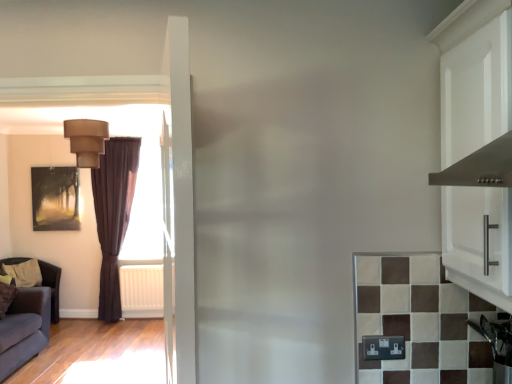
You are a GUI agent. You are given a task and a screenshot of the screen. Output one action in this format:
    pyautogui.click(x=<x>, y=<y>)
    Task: Click on the dark brown leather armchair at left
    The height and width of the screenshot is (384, 512).
    Given the screenshot: What is the action you would take?
    pyautogui.click(x=52, y=286)

What do you see at coordinates (498, 346) in the screenshot?
I see `stainless steel oven at lower right` at bounding box center [498, 346].

Image resolution: width=512 pixels, height=384 pixels. What do you see at coordinates (25, 328) in the screenshot?
I see `dark gray fabric couch at lower left` at bounding box center [25, 328].

This screenshot has width=512, height=384. I want to click on white plastic radiator at left, so click(141, 287).

Locate an element on the screen. matte beige lampshade at upper left is located at coordinates (86, 140).

Identify the location of dark brown leather armchair at left. The image size is (512, 384). (52, 286).

How much distance is there between brown velvet curtain at left and dark brown leather armchair at left?

brown velvet curtain at left and dark brown leather armchair at left are 84.39 centimeters apart.

Based on the photo, considering the relative sizes of brown velvet curtain at left and dark brown leather armchair at left in the image provided, is brown velvet curtain at left shorter than dark brown leather armchair at left?

Incorrect, the height of brown velvet curtain at left does not fall short of that of dark brown leather armchair at left.

Can you tell me how much brown velvet curtain at left and dark brown leather armchair at left differ in facing direction?

The angular difference between brown velvet curtain at left and dark brown leather armchair at left is 89.4 degrees.

Is brown velvet curtain at left next to dark brown leather armchair at left and touching it?

No, brown velvet curtain at left is not making contact with dark brown leather armchair at left.

From a real-world perspective, is dark brown leather armchair at left above or below brown velvet curtain at left?

In terms of real-world spatial position, dark brown leather armchair at left is below brown velvet curtain at left.

Considering the positions of objects dark brown leather armchair at left and brown velvet curtain at left in the image provided, who is behind, dark brown leather armchair at left or brown velvet curtain at left?

brown velvet curtain at left.

At what (x,y) coordinates should I click in order to perform the action: click on furniture that is under the brown velvet curtain at left (from a real-world perspective). Please return your answer as a coordinate pair (x, y). The width and height of the screenshot is (512, 384). Looking at the image, I should click on (52, 286).

Which object is further away from the camera, brown velvet curtain at left or matte beige lampshade at upper left?

brown velvet curtain at left.

In the scene shown: From a real-world perspective, is brown velvet curtain at left physically located above or below matte beige lampshade at upper left?

In terms of real-world spatial position, brown velvet curtain at left is below matte beige lampshade at upper left.

Which is behind, point (117, 225) or point (72, 126)?

Positioned behind is point (117, 225).

From the image's perspective, between brown velvet curtain at left and matte beige lampshade at upper left, which one is located above?

matte beige lampshade at upper left.

Is the surface of dark gray fabric couch at lower left in direct contact with matte beige lampshade at upper left?

There is a gap between dark gray fabric couch at lower left and matte beige lampshade at upper left.

Based on the photo, who is taller, dark gray fabric couch at lower left or matte beige lampshade at upper left?

Standing taller between the two is dark gray fabric couch at lower left.

Is dark gray fabric couch at lower left thinner than matte beige lampshade at upper left?

No.

In the image, there is a dark gray fabric couch at lower left. Identify the location of light fixture above it (from the image's perspective). This screenshot has height=384, width=512. (86, 140).

Is dark brown leather armchair at left beside matte black painting at left?

dark brown leather armchair at left and matte black painting at left are not in contact.

From the image's perspective, which object appears higher, dark brown leather armchair at left or matte black painting at left?

matte black painting at left.

Considering their positions, is dark brown leather armchair at left located in front of or behind matte black painting at left?

Clearly, dark brown leather armchair at left is in front of matte black painting at left.

From a real-world perspective, which object stands above the other?

From a 3D spatial view, matte black painting at left is above.

Considering their positions, is stainless steel oven at lower right located in front of or behind brown velvet curtain at left?

Visually, stainless steel oven at lower right is located in front of brown velvet curtain at left.

Based on the photo, does stainless steel oven at lower right contain brown velvet curtain at left?

No, stainless steel oven at lower right does not contain brown velvet curtain at left.

Consider the image. In terms of height, does stainless steel oven at lower right look taller or shorter compared to brown velvet curtain at left?

In the image, stainless steel oven at lower right appears to be shorter than brown velvet curtain at left.

From the image's perspective, between stainless steel oven at lower right and brown velvet curtain at left, who is located below?

stainless steel oven at lower right.

Is white plastic radiator at left next to matte beige lampshade at upper left?

No, white plastic radiator at left is not in contact with matte beige lampshade at upper left.

From a real-world perspective, is white plastic radiator at left over matte beige lampshade at upper left?

Incorrect, from a real-world perspective, white plastic radiator at left is lower than matte beige lampshade at upper left.

Is point (155, 276) positioned in front of point (97, 128)?

No, it is not.

Is white plastic radiator at left bigger or smaller than matte beige lampshade at upper left?

Considering their sizes, white plastic radiator at left takes up less space than matte beige lampshade at upper left.

The width and height of the screenshot is (512, 384). I want to click on furniture located below the brown velvet curtain at left (from the image's perspective), so click(52, 286).

This screenshot has height=384, width=512. I want to click on curtain that is on the right side of dark brown leather armchair at left, so click(x=113, y=215).

Consider the image. From the image, which object appears to be farther from stainless steel oven at lower right, white plastic radiator at left or dark brown leather armchair at left?

dark brown leather armchair at left is positioned further to the anchor stainless steel oven at lower right.

Estimate the real-world distances between objects in this image. Which object is closer to brown velvet curtain at left, matte black painting at left or dark brown leather armchair at left?

matte black painting at left is positioned closer to the anchor brown velvet curtain at left.

When comparing their distances from matte black painting at left, does stainless steel oven at lower right or white plastic radiator at left seem further?

Based on the image, stainless steel oven at lower right appears to be further to matte black painting at left.

From the picture: Considering their positions, is matte beige lampshade at upper left positioned further to stainless steel oven at lower right than dark gray fabric couch at lower left?

dark gray fabric couch at lower left lies further to stainless steel oven at lower right than the other object.

Which object lies further to the anchor point matte black painting at left, brown velvet curtain at left or dark brown leather armchair at left?

Based on the image, dark brown leather armchair at left appears to be further to matte black painting at left.

From the image, which object appears to be nearer to matte black painting at left, white plastic radiator at left or brown velvet curtain at left?

brown velvet curtain at left lies closer to matte black painting at left than the other object.

Considering their positions, is stainless steel oven at lower right positioned closer to matte black painting at left than dark gray fabric couch at lower left?

Based on the image, dark gray fabric couch at lower left appears to be nearer to matte black painting at left.

Which object lies nearer to the anchor point white plastic radiator at left, dark brown leather armchair at left or dark gray fabric couch at lower left?

The object closer to white plastic radiator at left is dark brown leather armchair at left.

Locate an element on the screen. furniture between stainless steel oven at lower right and brown velvet curtain at left from front to back is located at coordinates 52,286.

You are a GUI agent. You are given a task and a screenshot of the screen. Output one action in this format:
    pyautogui.click(x=<x>, y=<y>)
    Task: Click on the curtain between matte beige lampshade at upper left and matte black painting at left in the front-back direction
    Image resolution: width=512 pixels, height=384 pixels.
    Given the screenshot: What is the action you would take?
    pyautogui.click(x=113, y=215)

Where is `curtain between dark gray fabric couch at lower left and matte black painting at left in the front-back direction`? curtain between dark gray fabric couch at lower left and matte black painting at left in the front-back direction is located at coordinates (113, 215).

Locate an element on the screen. The height and width of the screenshot is (384, 512). light fixture between dark brown leather armchair at left and stainless steel oven at lower right in the horizontal direction is located at coordinates (86, 140).